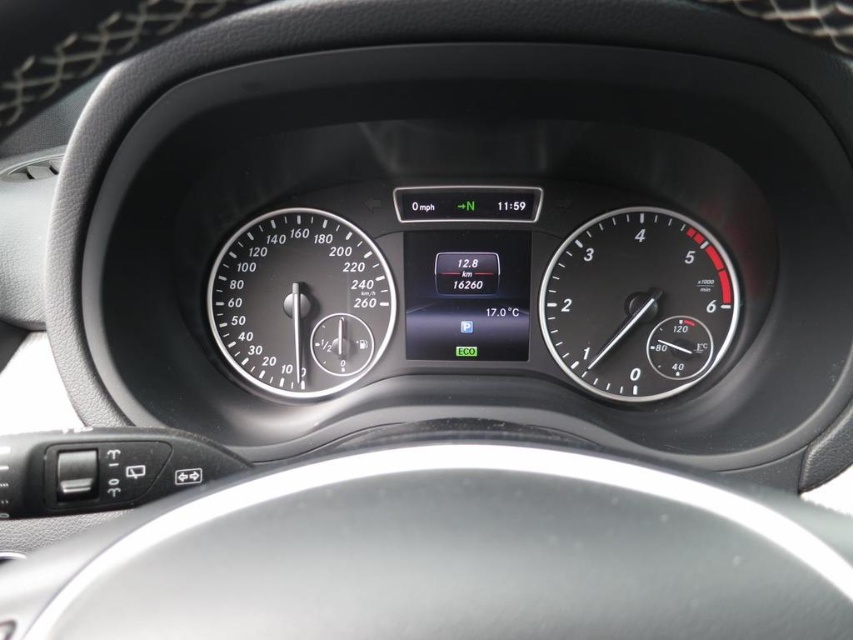
Question: Can you confirm if black metallic speedometer at center right is bigger than black glass speedometer at center?

Choices:
 (A) no
 (B) yes

Answer: (A)

Question: In this image, where is black metallic speedometer at center right located relative to black glass speedometer at center?

Choices:
 (A) above
 (B) below

Answer: (B)

Question: Is black metallic speedometer at center right to the left of black glass speedometer at center from the viewer's perspective?

Choices:
 (A) yes
 (B) no

Answer: (B)

Question: Among these points, which one is nearest to the camera?

Choices:
 (A) (334, 291)
 (B) (688, 356)

Answer: (B)

Question: Which object appears closest to the camera in this image?

Choices:
 (A) black metallic speedometer at center right
 (B) black glass speedometer at center

Answer: (A)